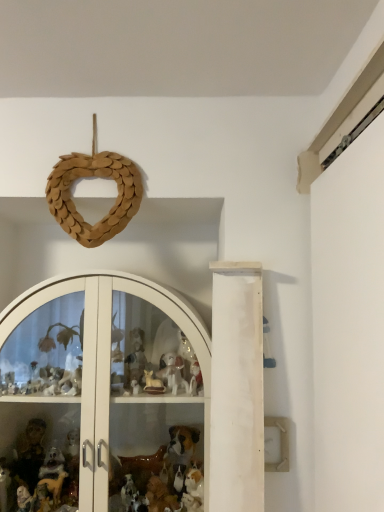
Question: Can you confirm if wooden heart at upper center is shorter than white glossy glass door at center?

Choices:
 (A) yes
 (B) no

Answer: (A)

Question: Is white glossy glass door at center surrounded by wooden heart at upper center?

Choices:
 (A) no
 (B) yes

Answer: (A)

Question: Considering the relative sizes of wooden heart at upper center and white glossy glass door at center in the image provided, is wooden heart at upper center taller than white glossy glass door at center?

Choices:
 (A) no
 (B) yes

Answer: (A)

Question: Is wooden heart at upper center oriented away from white glossy glass door at center?

Choices:
 (A) yes
 (B) no

Answer: (B)

Question: Is wooden heart at upper center behind white glossy glass door at center?

Choices:
 (A) no
 (B) yes

Answer: (B)

Question: From the image's perspective, is wooden heart at upper center over white glossy glass door at center?

Choices:
 (A) yes
 (B) no

Answer: (A)

Question: From the image's perspective, would you say white glossy glass door at center is positioned over wooden heart at upper center?

Choices:
 (A) no
 (B) yes

Answer: (A)

Question: Is white glossy glass door at center in contact with wooden heart at upper center?

Choices:
 (A) yes
 (B) no

Answer: (B)

Question: Is white glossy glass door at center oriented towards wooden heart at upper center?

Choices:
 (A) yes
 (B) no

Answer: (B)

Question: From a real-world perspective, is white glossy glass door at center located higher than wooden heart at upper center?

Choices:
 (A) yes
 (B) no

Answer: (B)

Question: Is white glossy glass door at center thinner than wooden heart at upper center?

Choices:
 (A) no
 (B) yes

Answer: (A)

Question: Considering the relative positions of white glossy glass door at center and wooden heart at upper center in the image provided, is white glossy glass door at center behind wooden heart at upper center?

Choices:
 (A) yes
 (B) no

Answer: (B)

Question: Which is correct: white glossy glass door at center is inside wooden heart at upper center, or outside of it?

Choices:
 (A) outside
 (B) inside

Answer: (A)